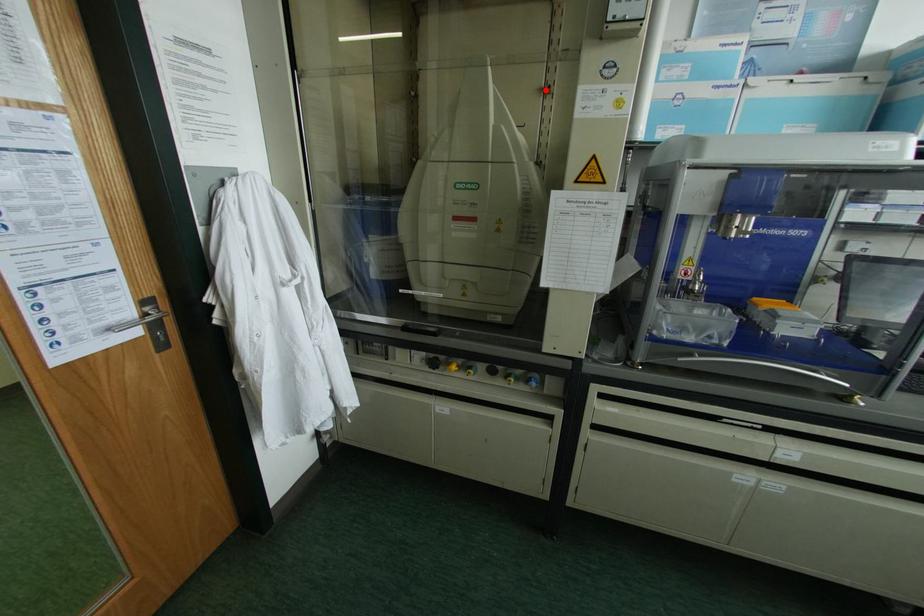
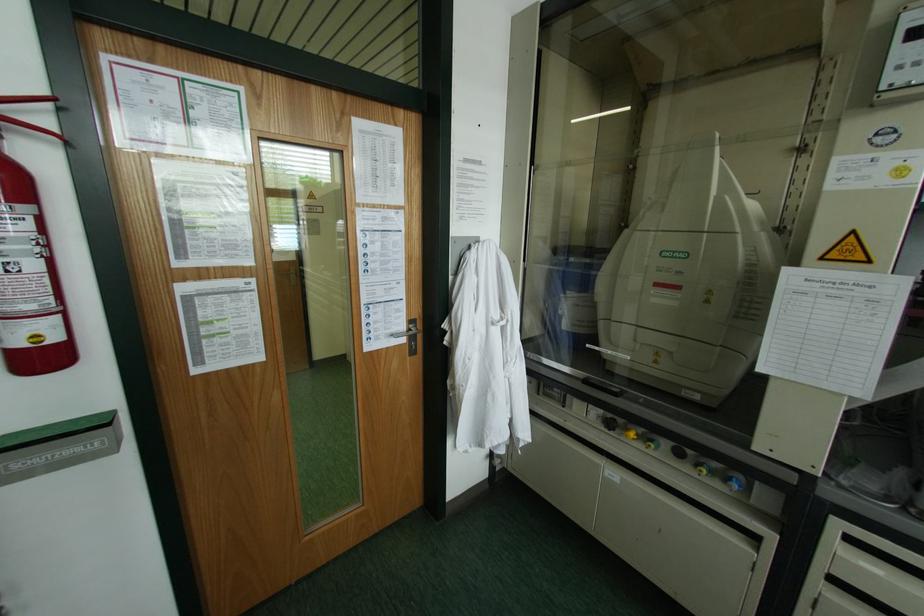
The point at the highlighted location is marked in the first image. Where is the corresponding point in the second image?

(800, 148)